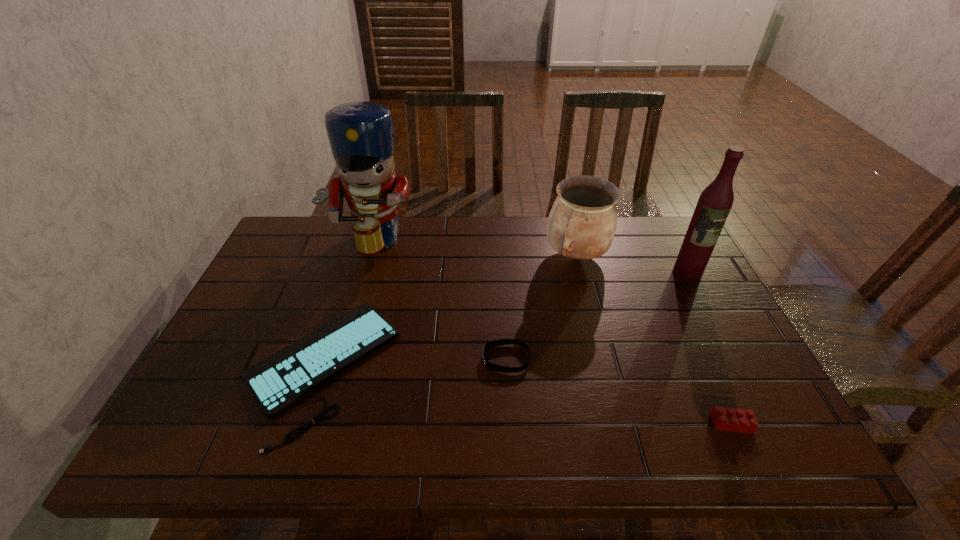
Where is `nutcracker`? nutcracker is located at coordinates (361, 136).

Image resolution: width=960 pixels, height=540 pixels. I want to click on liquor, so click(x=715, y=202).

At what (x,y) coordinates should I click in order to perform the action: click on urn. Please return your answer as a coordinate pair (x, y). The height and width of the screenshot is (540, 960). Looking at the image, I should click on (581, 225).

The image size is (960, 540). Identify the location of the fourth object from left to right. (581, 225).

Locate an element on the screen. The width and height of the screenshot is (960, 540). Lego is located at coordinates (728, 419).

The width and height of the screenshot is (960, 540). Identify the location of the fourth object from right to left. (494, 343).

I want to click on computer keyboard, so click(277, 381).

The image size is (960, 540). Identify the location of vacant space located on the front-facing side of the nutcracker. (349, 299).

You are a GUI agent. You are given a task and a screenshot of the screen. Output one action in this format:
    pyautogui.click(x=<x>, y=<y>)
    Task: Click on the vacant space located on the label of the liquor
    
    Given the screenshot: What is the action you would take?
    pyautogui.click(x=751, y=396)

Image resolution: width=960 pixels, height=540 pixels. What are the coordinates of `vacant point located 0.080m on the front of the third object from right to left` in the screenshot? It's located at (587, 297).